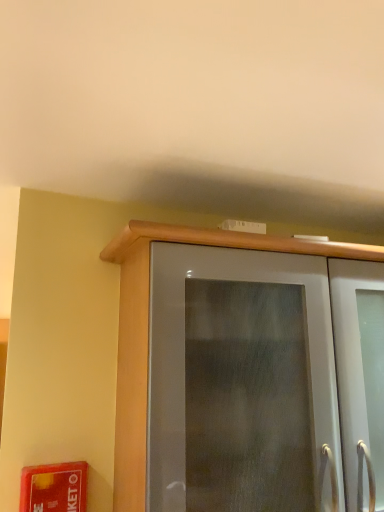
What is the approximate width of matte glass cabinet at center?

matte glass cabinet at center is 14.40 inches in width.

What are the coordinates of `matte glass cabinet at center` in the screenshot? It's located at (148, 329).

Image resolution: width=384 pixels, height=512 pixels. What do you see at coordinates (148, 329) in the screenshot?
I see `matte glass cabinet at center` at bounding box center [148, 329].

Where is `matte glass cabinet at center`? The image size is (384, 512). matte glass cabinet at center is located at coordinates (148, 329).